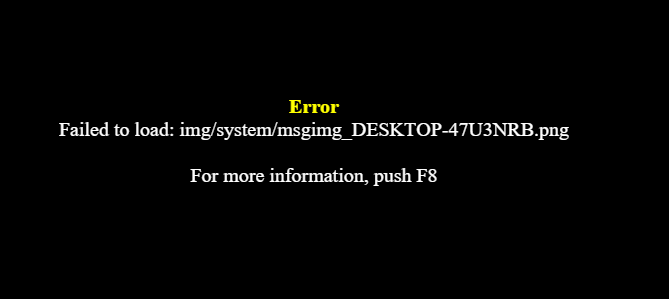
The height and width of the screenshot is (299, 669). Identify the location of computer key. (429, 176).